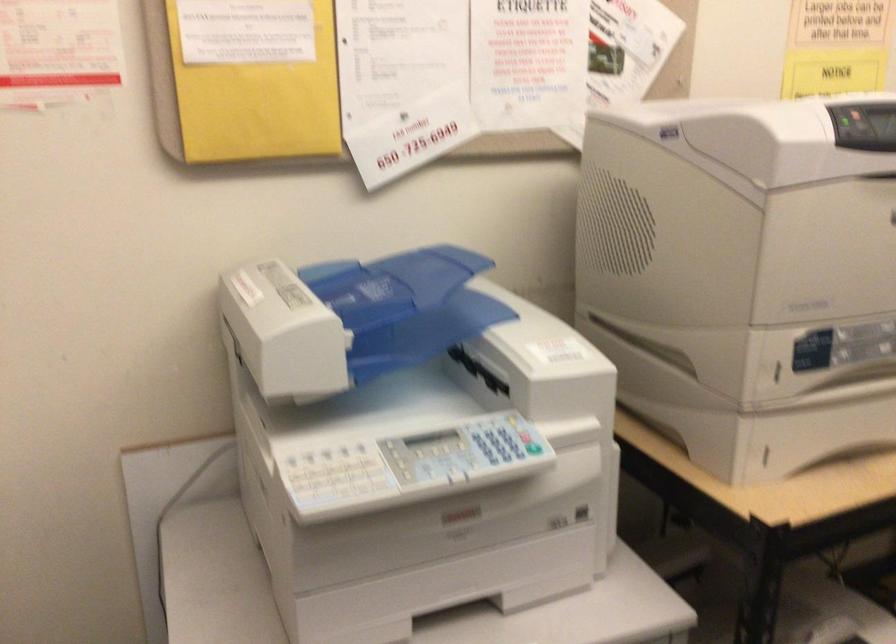
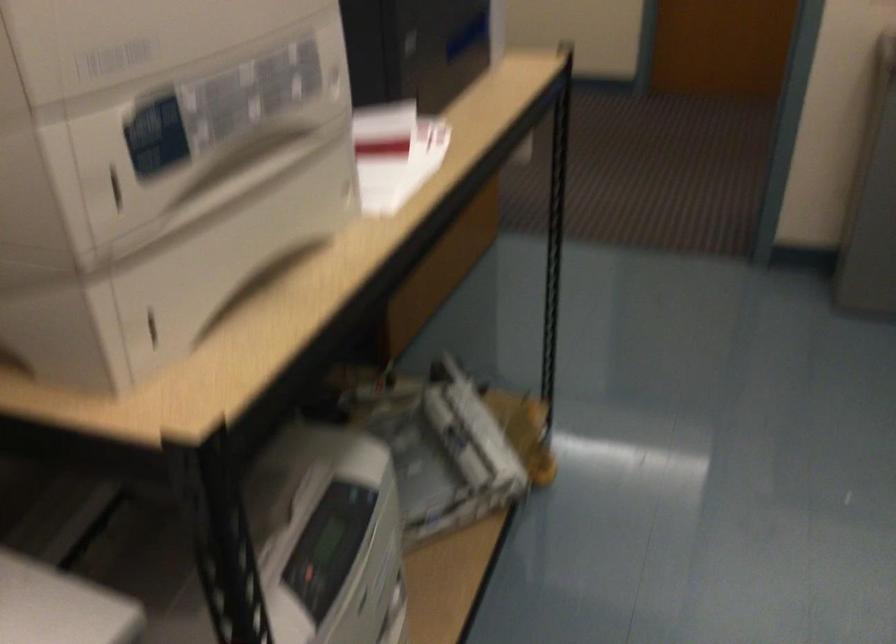
How did the camera likely rotate?

The camera rotated toward right-down.